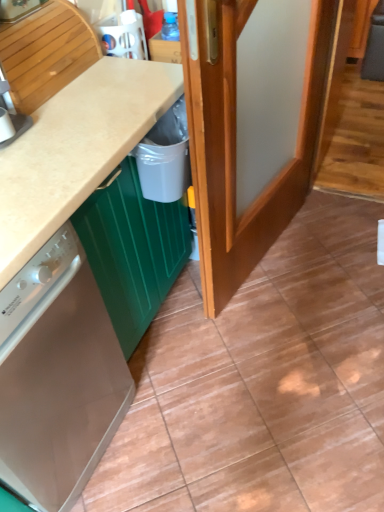
Identify the location of vacant space underneath wooden door at center (from a real-world perspective). (273, 266).